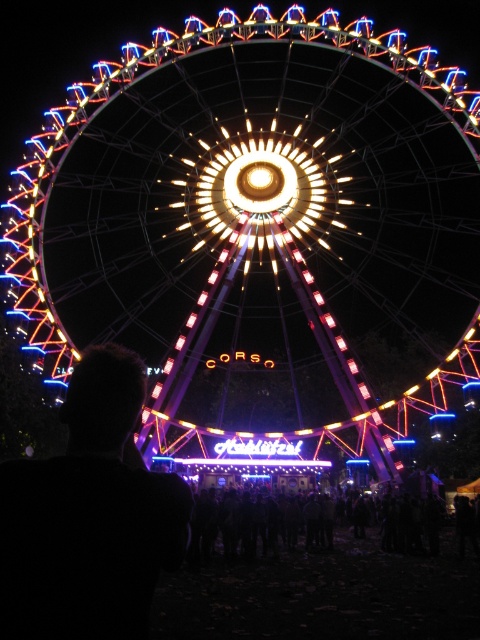
You are standing at the base of the Ferris wheel and want to take a photo of the central hub. A point at coordinates point (151,64) is part of the Ferris wheel structure. If your camera has a maximum focus range of 150 meters, will you be able to focus on the central hub?

The distance of point (151,64) from viewer is 153.36 meters, which exceeds the camera maximum focus range of 150 meters. Therefore, the camera cannot focus on the central hub.

You are a photographer trying to capture the illuminated steel ferris wheel at center and the black hair at left in a single shot. Based on their positions, which object should you frame first to ensure both are included in the photo?

The black hair at left should be framed first since the illuminated steel ferris wheel at center is positioned to its right, meaning the hair is closer to the left edge of the frame. By starting with the hair, you can adjust the camera angle to include both objects in the shot.

You are attending a nighttime event and notice two groups of people in the image. One group has black hair at left and the other is part of the black fabric crowd at lower center. Which group appears larger in size?

The black hair at left appears larger in size than the black fabric crowd at lower center according to the description.